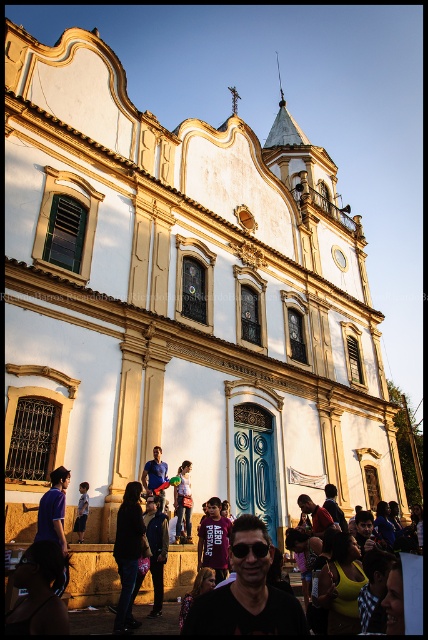
Is dark brown leather jacket at lower left thinner than maroon jersey at center?

No.

Between point (55, 577) and point (199, 540), which one is positioned behind?

The point (199, 540) is behind.

What are the coordinates of `dark brown leather jacket at lower left` in the screenshot? It's located at pyautogui.click(x=38, y=593).

Which is below, yellow-green fabric at lower center or black matte dress at center?

black matte dress at center is below.

Is point (353, 577) farther from viewer compared to point (118, 604)?

No.

Find the location of a particular element. Image resolution: width=428 pixels, height=640 pixels. yellow-green fabric at lower center is located at coordinates (341, 586).

Does yellow-green fabric at lower center have a lesser width compared to dark blue jeans at center?

No, yellow-green fabric at lower center is not thinner than dark blue jeans at center.

Does yellow-green fabric at lower center appear under dark blue jeans at center?

Incorrect, yellow-green fabric at lower center is not positioned below dark blue jeans at center.

Locate an element on the screen. The image size is (428, 640). yellow-green fabric at lower center is located at coordinates (341, 586).

This screenshot has height=640, width=428. In order to click on yellow-green fabric at lower center in this screenshot , I will do `click(341, 586)`.